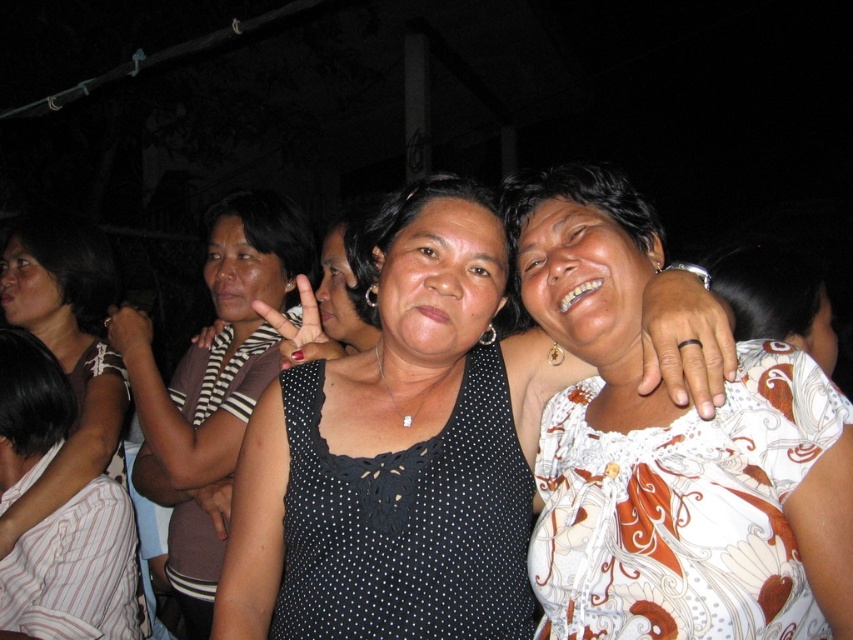
You are taking a photo of the two women in the center of the image. The first woman is at point (309, 632) and the second woman is at point (44, 497). Which woman is closer to the camera?

The woman at point (309, 632) is closer to the camera than the woman at point (44, 497).

You are at a party and want to take a photo with both the matte black dress at center and the striped fabric dress at center in the frame. Given their heights, which dress should you position closer to the camera to ensure both are fully visible?

The striped fabric dress at center is shorter than the matte black dress at center. To ensure both are fully visible in the photo, position the striped fabric dress at center closer to the camera so its shorter height balances the composition.

You are a photographer at the event and want to ensure both dresses are visible in the photo. Since the white printed fabric dress at center is thinner than the black dotted fabric dress at center, which dress should you position closer to the camera to avoid overlapping?

The white printed fabric dress at center is thinner than the black dotted fabric dress at center, so positioning the white printed fabric dress at center closer to the camera will help prevent overlapping as it takes up less space.